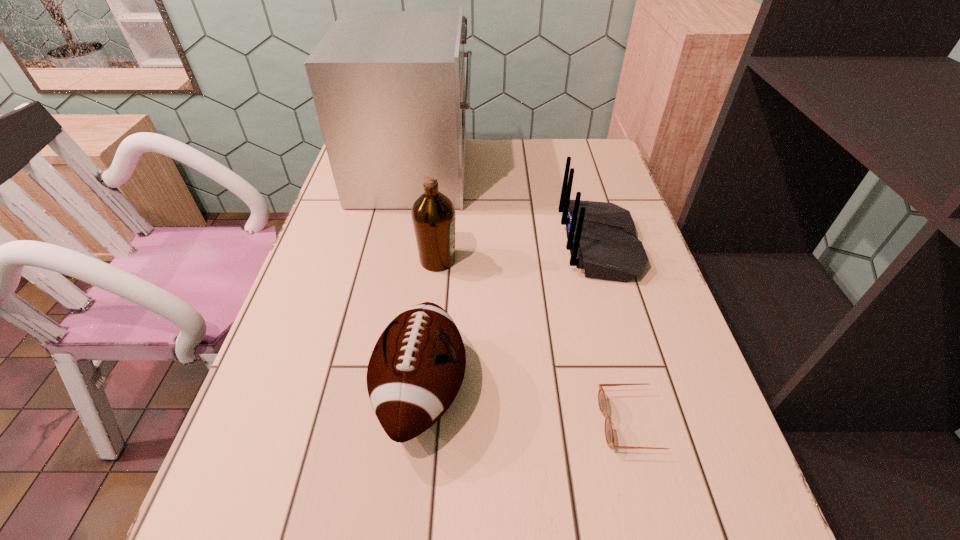
In order to click on free space between the olive oil and the router in this screenshot , I will do `click(518, 252)`.

In order to click on vacant area that lies between the router and the second tallest object in this screenshot , I will do `click(518, 252)`.

Where is `object that stands as the second closest to the football (American)`? This screenshot has width=960, height=540. object that stands as the second closest to the football (American) is located at coordinates (609, 435).

Where is `the fourth closest object to the router`? The height and width of the screenshot is (540, 960). the fourth closest object to the router is located at coordinates (609, 435).

Locate an element on the screen. This screenshot has height=540, width=960. vacant area in the image that satisfies the following two spatial constraints: 1. on the back of the router; 2. on the front side of the football (American) is located at coordinates (642, 390).

Find the location of `free region that satisfies the following two spatial constraints: 1. on the back side of the football (American); 2. on the front panel of the farthest object`. free region that satisfies the following two spatial constraints: 1. on the back side of the football (American); 2. on the front panel of the farthest object is located at coordinates (444, 172).

The height and width of the screenshot is (540, 960). What are the coordinates of `vacant area in the image that satisfies the following two spatial constraints: 1. on the back of the router; 2. on the front side of the football (American)` in the screenshot? It's located at (642, 390).